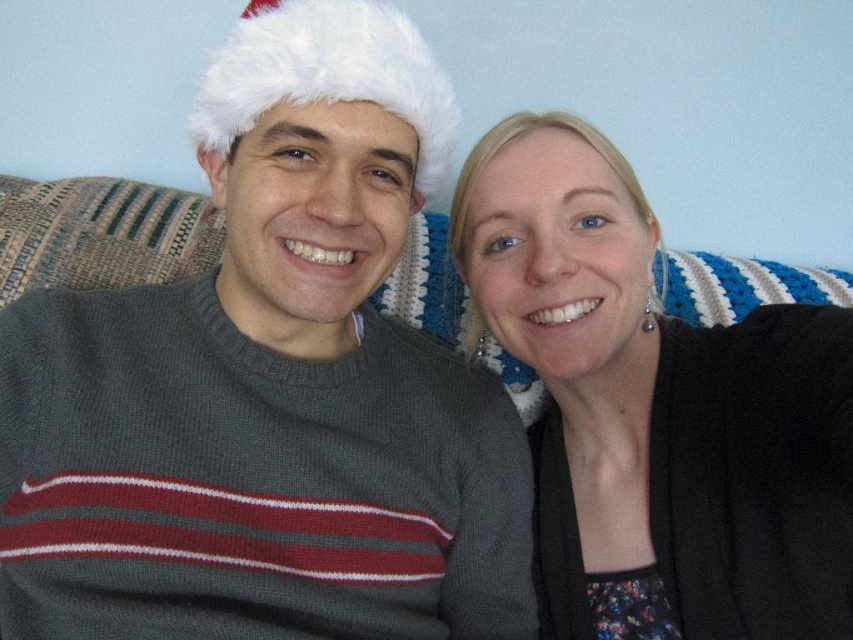
Question: Considering the real-world distances, which object is farthest from the black matte sweater at right?

Choices:
 (A) white fluffy hat at upper center
 (B) knit gray sweater at center

Answer: (A)

Question: Which is nearer to the white fluffy hat at upper center?

Choices:
 (A) knit gray sweater at center
 (B) black matte sweater at right

Answer: (A)

Question: Can you confirm if knit gray sweater at center is positioned below white fluffy hat at upper center?

Choices:
 (A) yes
 (B) no

Answer: (A)

Question: Which object appears farthest from the camera in this image?

Choices:
 (A) knit gray sweater at center
 (B) black matte sweater at right
 (C) white fluffy hat at upper center

Answer: (A)

Question: From the image, what is the correct spatial relationship of knit gray sweater at center in relation to white fluffy hat at upper center?

Choices:
 (A) below
 (B) above

Answer: (A)

Question: Can you confirm if knit gray sweater at center is positioned to the left of white fluffy hat at upper center?

Choices:
 (A) yes
 (B) no

Answer: (B)